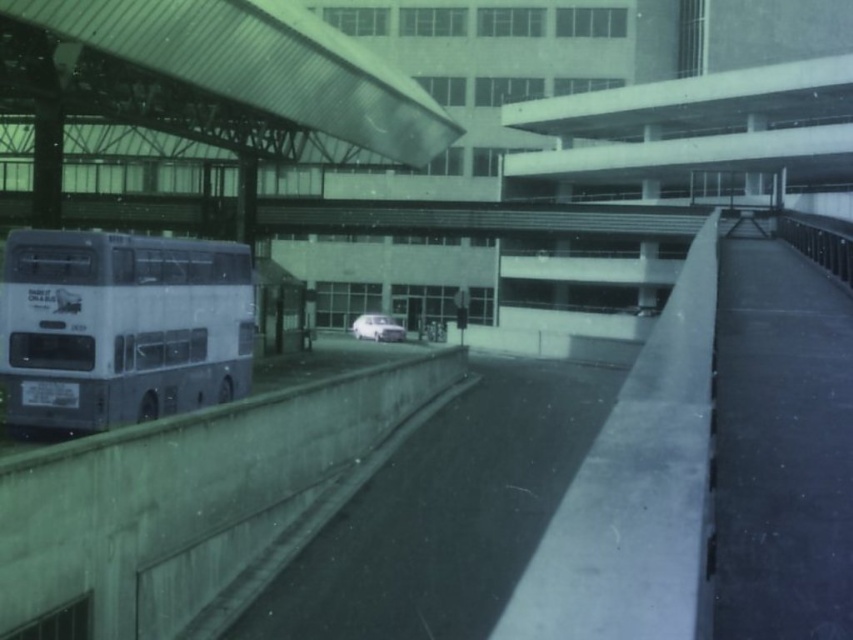
You are standing in front of the modern building and want to determine the relative positions of two points on the structure. The first point is labeled as point (132, 348) and the second is point (358, 317). Which of these points is nearer to your current position?

Point (132, 348) is closer to the viewer than point (358, 317).

You are a pedestrian standing at the crosswalk and see the silver metallic bus at left and the white matte van at center. Which vehicle is closer to you?

The silver metallic bus at left is closer to you because it is positioned in front of the white matte van at center.